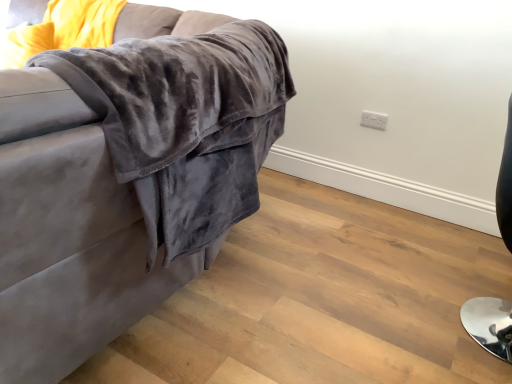
Question: Considering the relative positions of shiny black chair at right and velvet gray couch at upper left in the image provided, is shiny black chair at right in front of velvet gray couch at upper left?

Choices:
 (A) yes
 (B) no

Answer: (B)

Question: Does shiny black chair at right have a larger size compared to velvet gray couch at upper left?

Choices:
 (A) no
 (B) yes

Answer: (A)

Question: From the image's perspective, would you say shiny black chair at right is shown under velvet gray couch at upper left?

Choices:
 (A) no
 (B) yes

Answer: (B)

Question: Can you confirm if shiny black chair at right is thinner than velvet gray couch at upper left?

Choices:
 (A) no
 (B) yes

Answer: (B)

Question: Is shiny black chair at right positioned behind velvet gray couch at upper left?

Choices:
 (A) yes
 (B) no

Answer: (A)

Question: From a real-world perspective, relative to shiny black chair at right, is white plastic electric outlet at upper right vertically above or below?

Choices:
 (A) above
 (B) below

Answer: (A)

Question: In terms of size, does white plastic electric outlet at upper right appear bigger or smaller than shiny black chair at right?

Choices:
 (A) small
 (B) big

Answer: (A)

Question: Considering the relative positions of white plastic electric outlet at upper right and shiny black chair at right in the image provided, is white plastic electric outlet at upper right to the left or to the right of shiny black chair at right?

Choices:
 (A) left
 (B) right

Answer: (A)

Question: Looking at their shapes, would you say white plastic electric outlet at upper right is wider or thinner than shiny black chair at right?

Choices:
 (A) wide
 (B) thin

Answer: (B)

Question: In the image, is white plastic electric outlet at upper right on the left side or the right side of velvet gray couch at upper left?

Choices:
 (A) right
 (B) left

Answer: (A)

Question: Is white plastic electric outlet at upper right inside the boundaries of velvet gray couch at upper left, or outside?

Choices:
 (A) outside
 (B) inside

Answer: (B)

Question: In terms of size, does white plastic electric outlet at upper right appear bigger or smaller than velvet gray couch at upper left?

Choices:
 (A) small
 (B) big

Answer: (A)

Question: From the image's perspective, is white plastic electric outlet at upper right located above or below velvet gray couch at upper left?

Choices:
 (A) below
 (B) above

Answer: (A)

Question: In terms of width, does velvet gray couch at upper left look wider or thinner when compared to shiny black chair at right?

Choices:
 (A) wide
 (B) thin

Answer: (A)

Question: Based on their sizes in the image, would you say velvet gray couch at upper left is bigger or smaller than shiny black chair at right?

Choices:
 (A) big
 (B) small

Answer: (A)